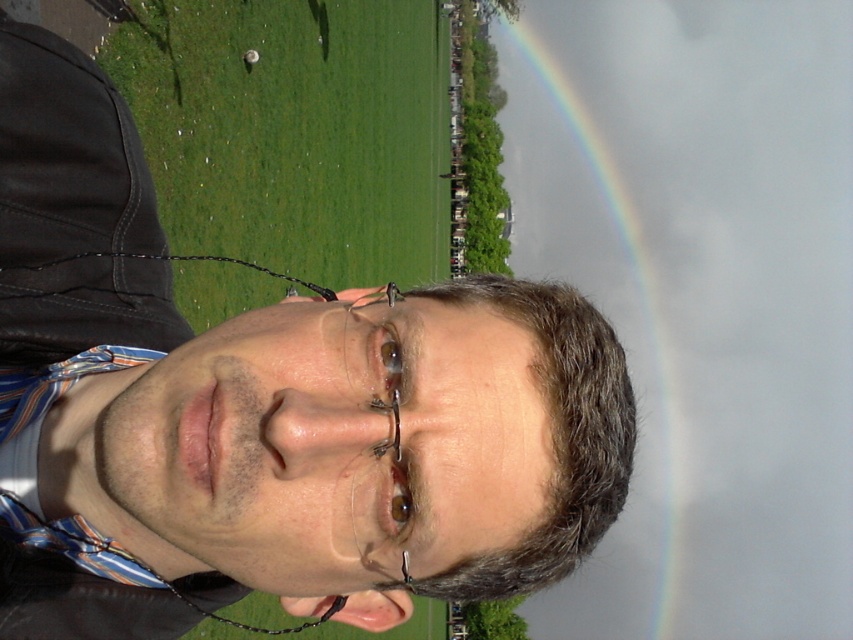
You are standing at the point marked as point [537,580] and want to walk towards the rainbow in the background. How far will you have to walk to reach the rainbow?

The distance between point [537,580] and the viewer is 36.09 feet. Since the rainbow is in the background, you would need to walk 36.09 feet to reach the rainbow from point [537,580].